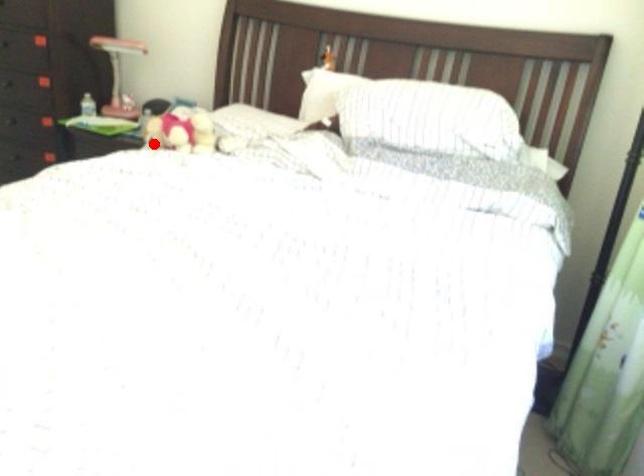
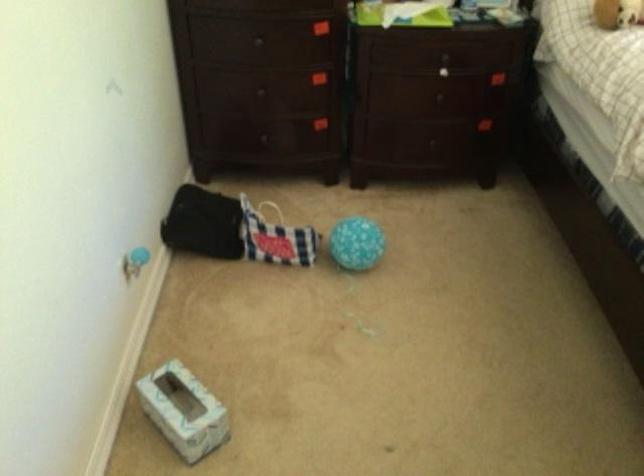
Question: I am providing you with two images of the same scene from different viewpoints. Image1 has a red point marked. In image2, the corresponding 3D location appears at what relative position? Reply with the corresponding letter.

Choices:
 (A) Closer
 (B) Farther

Answer: (A)